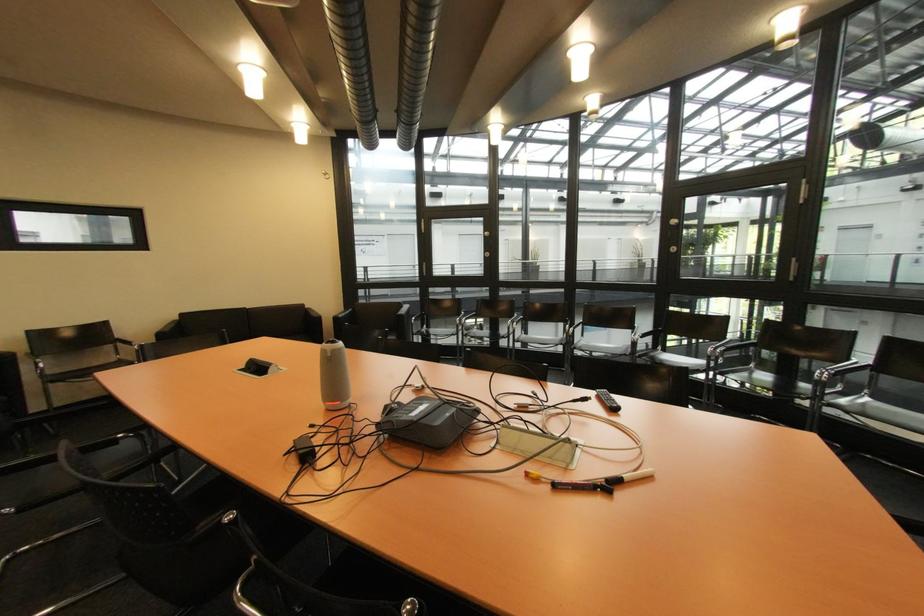
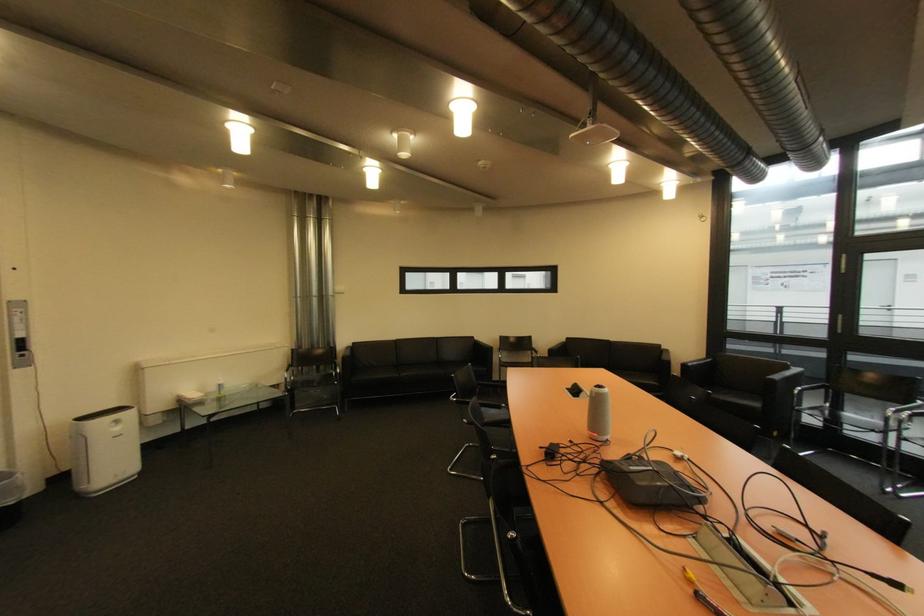
Find the pixel in the second image that matches pixel 462 336 in the first image.

(882, 432)